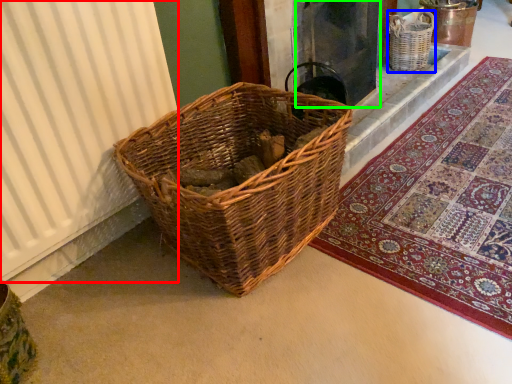
Question: Which object is positioned closest to curtain (highlighted by a red box)? Select from basket (highlighted by a blue box) and screen door (highlighted by a green box).

Choices:
 (A) basket
 (B) screen door

Answer: (B)